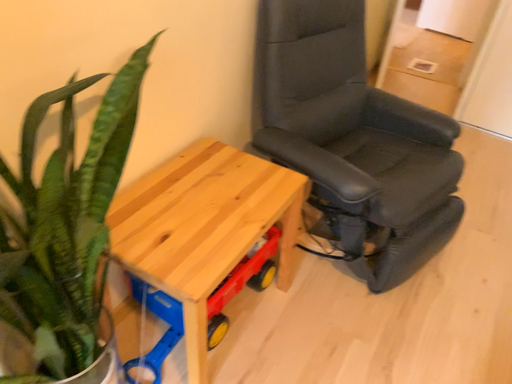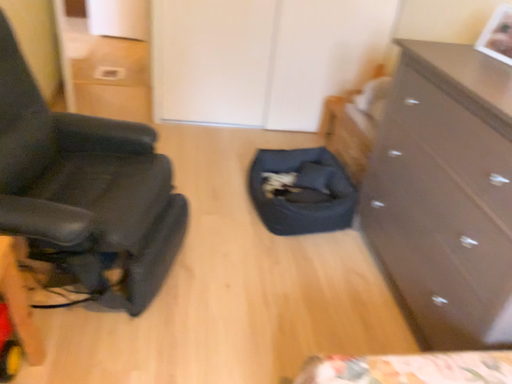
Question: How did the camera likely rotate when shooting the video?

Choices:
 (A) rotated right
 (B) rotated left

Answer: (A)